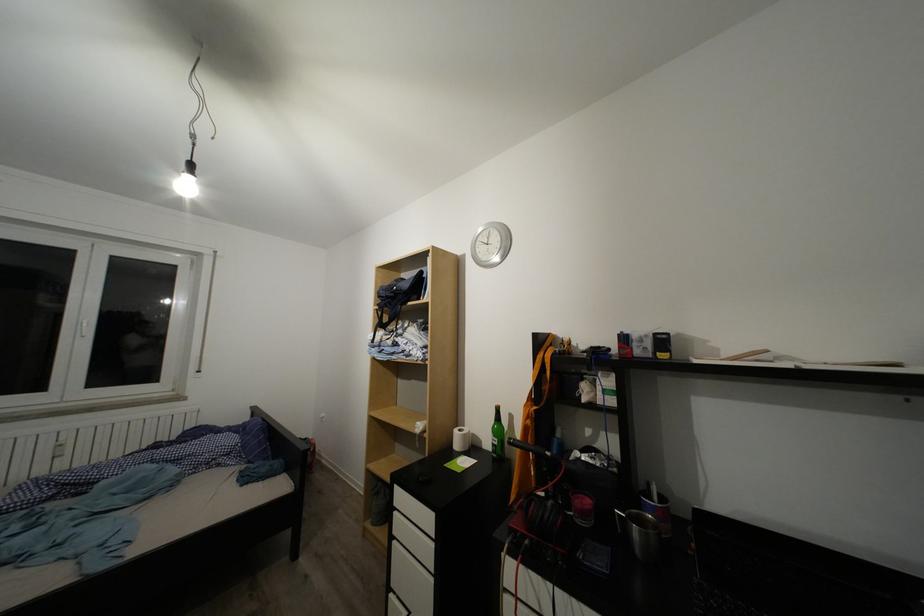
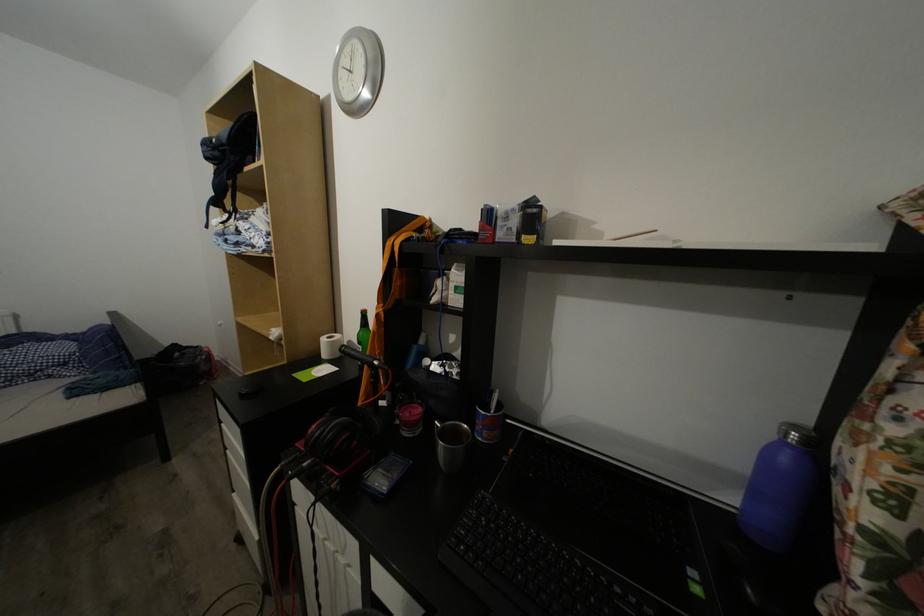
The images are taken continuously from a first-person perspective. In which direction are you moving?

The cameraman walked toward right, forward.